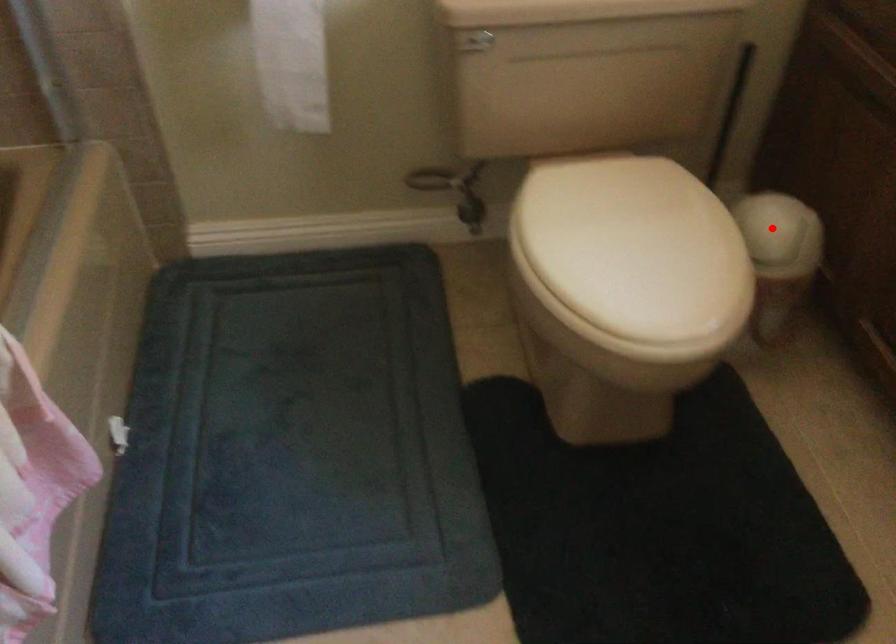
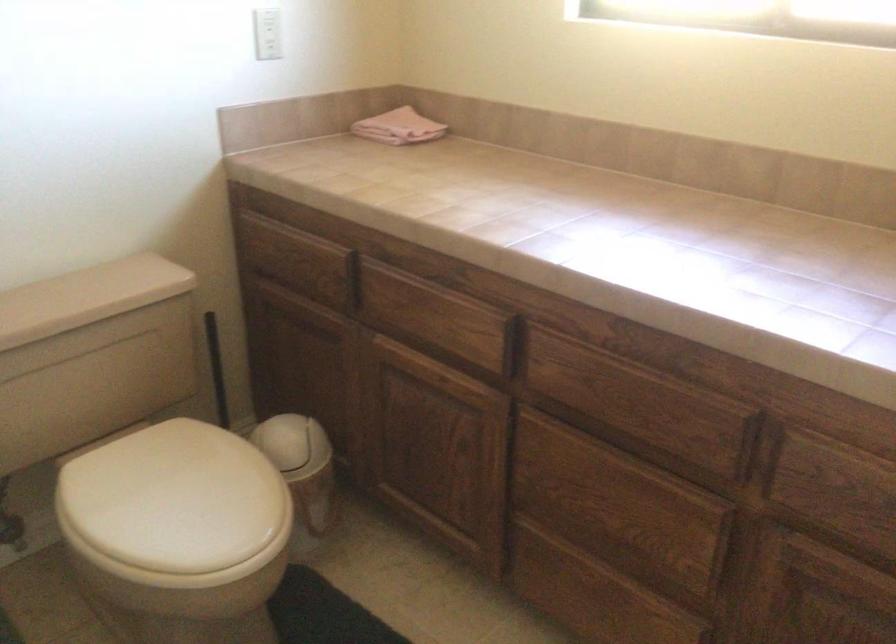
Where in the second image is the point corresponding to the highlighted location from the first image?

(293, 444)